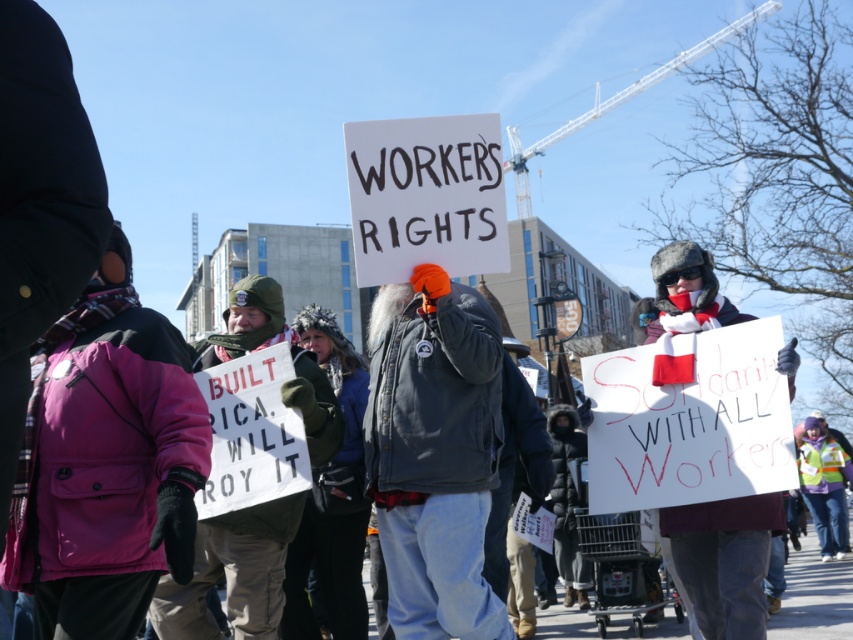
Which is more to the left, camouflage jacket at center or white paper sign at center?

Positioned to the left is camouflage jacket at center.

Is point (158, 586) closer to camera compared to point (740, 579)?

No, it is behind (740, 579).

Who is more distant from viewer, (277,566) or (758,627)?

The point (277,566) is behind.

The height and width of the screenshot is (640, 853). In order to click on camouflage jacket at center in this screenshot , I will do `click(233, 572)`.

Can you confirm if pink fleece jacket at upper left is shorter than white paper sign at center?

No.

Does pink fleece jacket at upper left come in front of white paper sign at center?

That is True.

Which is behind, point (30, 438) or point (689, 252)?

The point (689, 252) is behind.

Identify the location of pink fleece jacket at upper left. This screenshot has width=853, height=640. (105, 461).

Can you confirm if pink fleece jacket at upper left is bigger than denim jacket at center?

Yes, pink fleece jacket at upper left is bigger than denim jacket at center.

Looking at this image, which of these two, pink fleece jacket at upper left or denim jacket at center, stands shorter?

Standing shorter between the two is pink fleece jacket at upper left.

Is point (57, 333) in front of point (477, 424)?

Yes, point (57, 333) is in front of point (477, 424).

Where is `pink fleece jacket at upper left`? The width and height of the screenshot is (853, 640). pink fleece jacket at upper left is located at coordinates (105, 461).